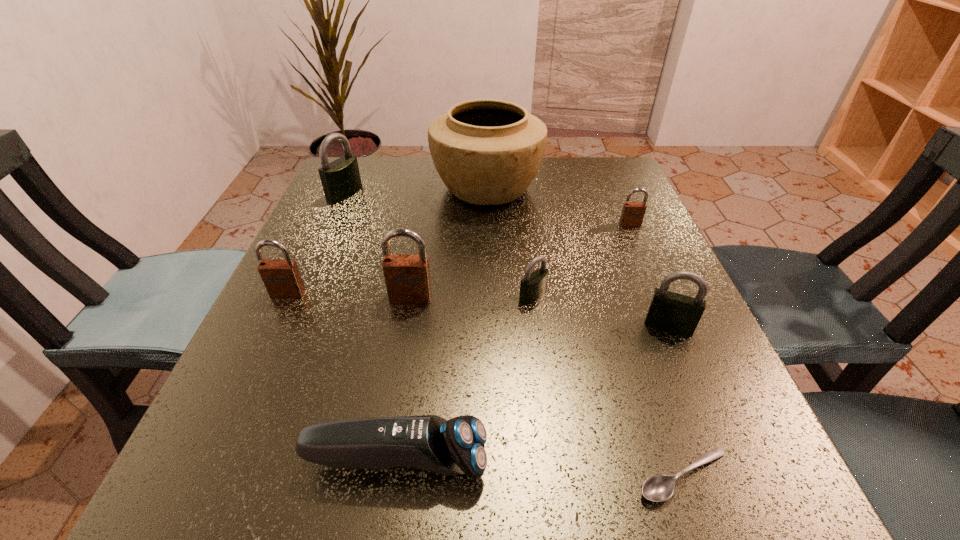
At what (x,y) coordinates should I click in order to perform the action: click on free space between the smallest brown padlock and the gray soupspoon. Please return your answer as a coordinate pair (x, y). Looking at the image, I should click on (657, 350).

Find the location of `free spot between the tallest object and the electric shaver`. free spot between the tallest object and the electric shaver is located at coordinates (442, 324).

Locate an element on the screen. free area in between the biggest brown padlock and the rightmost brown padlock is located at coordinates (520, 261).

Image resolution: width=960 pixels, height=540 pixels. What are the coordinates of `free area in between the soupspoon and the nearest black padlock` in the screenshot? It's located at (676, 401).

At what (x,y) coordinates should I click in order to perform the action: click on vacant region between the electric shaver and the shortest object. Please return your answer as a coordinate pair (x, y). The width and height of the screenshot is (960, 540). Looking at the image, I should click on (540, 468).

Identify the location of free point between the second brown padlock from left to right and the leftmost black padlock. This screenshot has width=960, height=540. (378, 246).

The image size is (960, 540). In order to click on empty location between the leftmost black padlock and the tallest object in this screenshot , I will do `click(416, 191)`.

Locate an element on the screen. empty space that is in between the tallest object and the third nearest object is located at coordinates (578, 256).

The image size is (960, 540). In order to click on unoccupied position between the shortest object and the biggest brown padlock in this screenshot , I will do `click(547, 387)`.

Image resolution: width=960 pixels, height=540 pixels. Find the location of `object that is the eighth closest to the second farthest padlock`. object that is the eighth closest to the second farthest padlock is located at coordinates (282, 279).